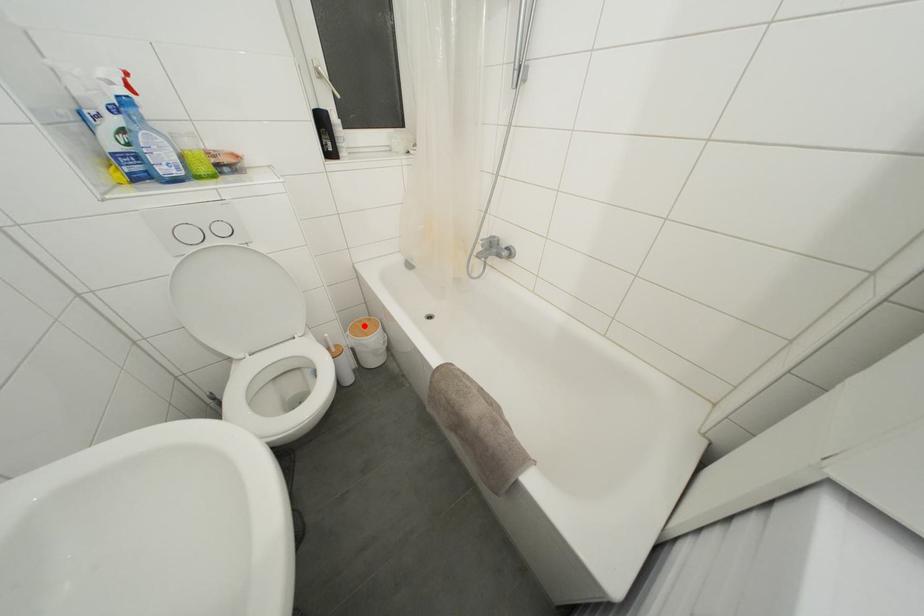
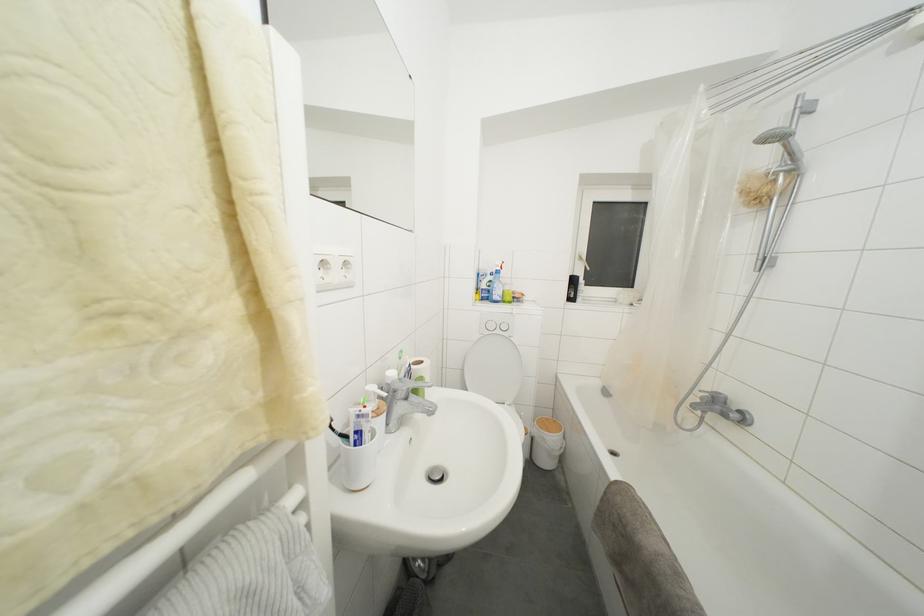
The point at the highlighted location is marked in the first image. Where is the corresponding point in the second image?

(552, 424)